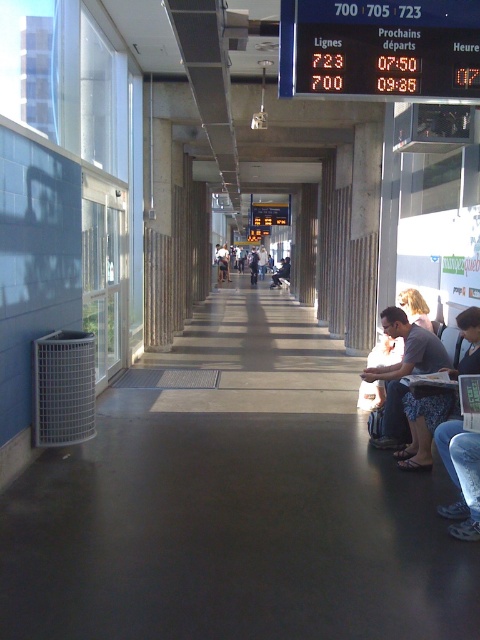
Between gray fabric shirt at lower right and matte gray backpack at center, which one is positioned lower?

Positioned lower is gray fabric shirt at lower right.

Can you confirm if gray fabric shirt at lower right is positioned to the right of matte gray backpack at center?

Yes, gray fabric shirt at lower right is to the right of matte gray backpack at center.

Where is `gray fabric shirt at lower right`? The image size is (480, 640). gray fabric shirt at lower right is located at coordinates (403, 372).

Which is in front, point (222, 253) or point (289, 264)?

Positioned in front is point (289, 264).

The height and width of the screenshot is (640, 480). What do you see at coordinates (259, 262) in the screenshot?
I see `matte gray backpack at center` at bounding box center [259, 262].

Is point (222, 260) closer to camera compared to point (284, 269)?

No, it is behind (284, 269).

Locate an element on the screen. This screenshot has height=640, width=480. matte gray backpack at center is located at coordinates (259, 262).

Is the position of blue denim shorts at lower right more distant than that of white cotton shirt at center?

No, it is in front of white cotton shirt at center.

Is point (476, 348) positioned behind point (273, 280)?

No.

The image size is (480, 640). Find the location of `blue denim shorts at lower right`. blue denim shorts at lower right is located at coordinates (422, 429).